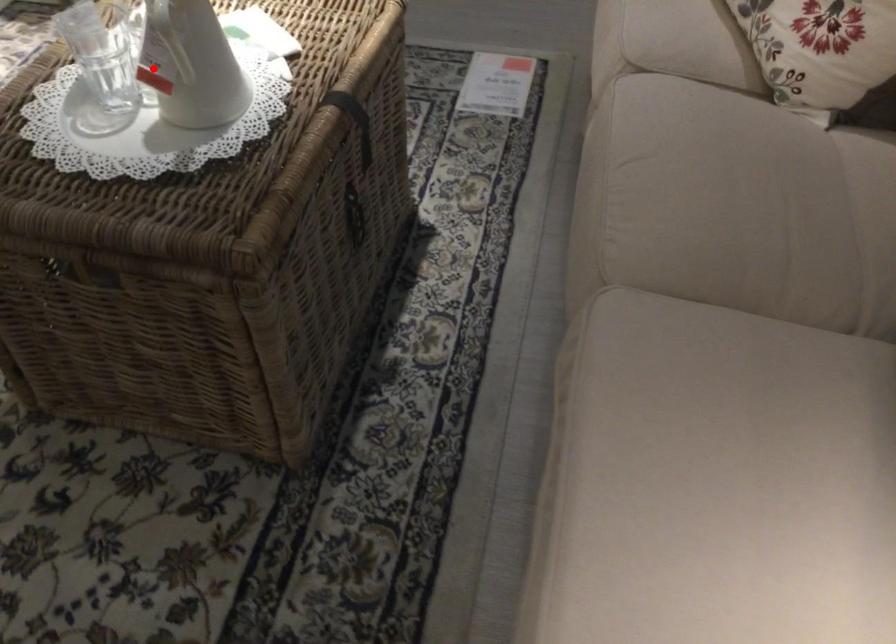
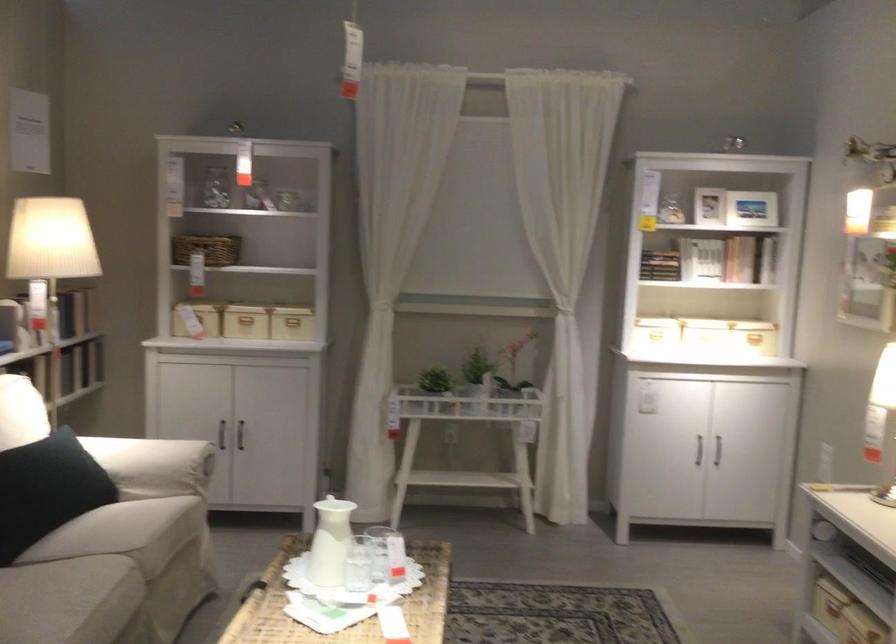
In the second image, find the point that corresponds to the highlighted location in the first image.

(358, 564)